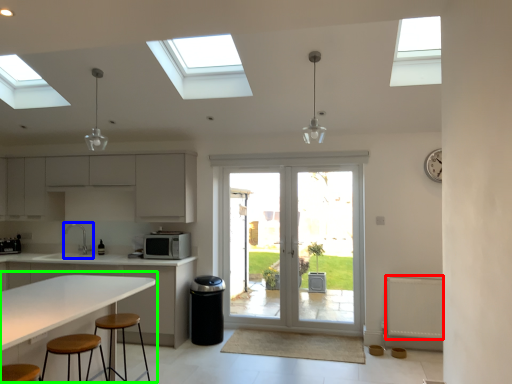
Question: Which object is positioned closest to radiator (highlighted by a red box)? Select from sink (highlighted by a blue box) and table (highlighted by a green box).

Choices:
 (A) sink
 (B) table

Answer: (B)